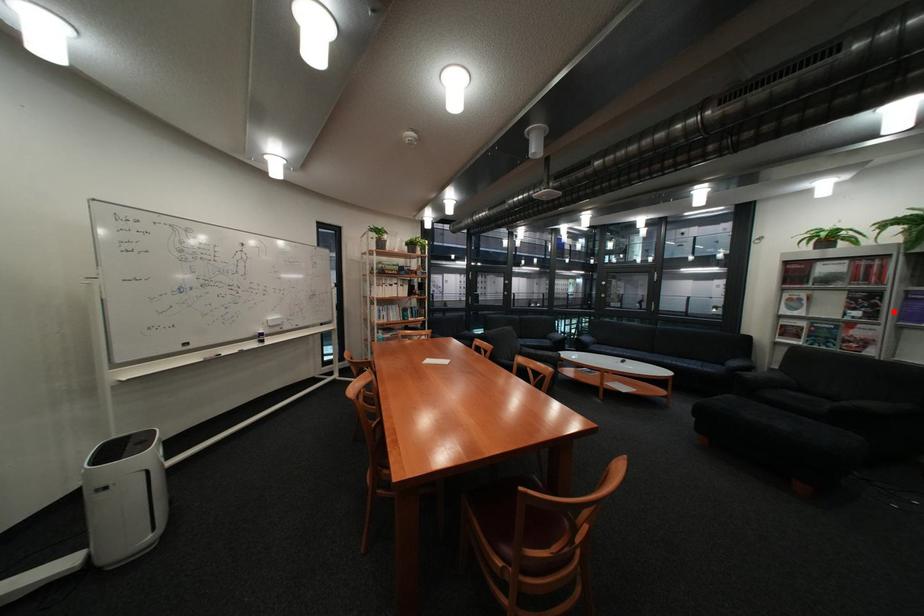
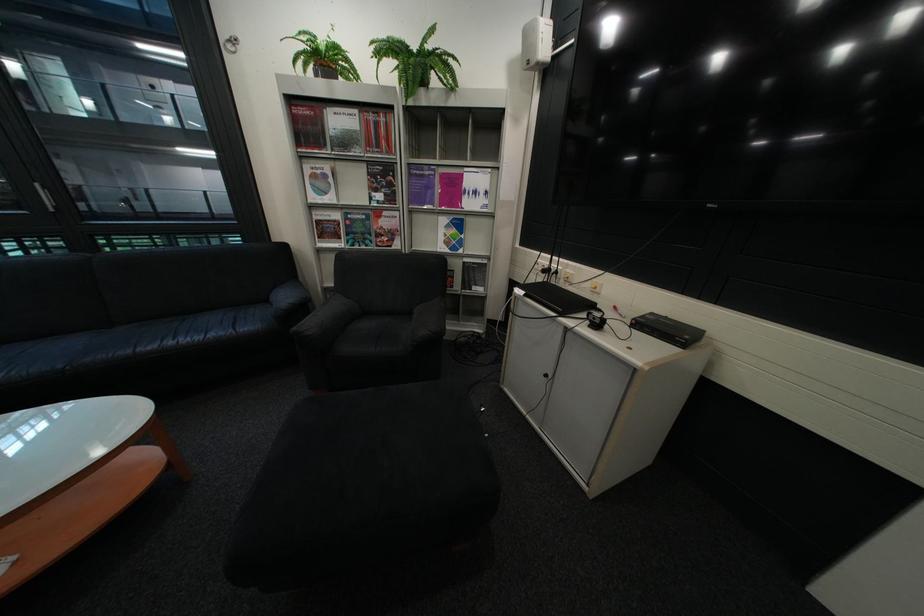
Find the pixel in the second image that matches the highlighted location in the first image.

(409, 192)